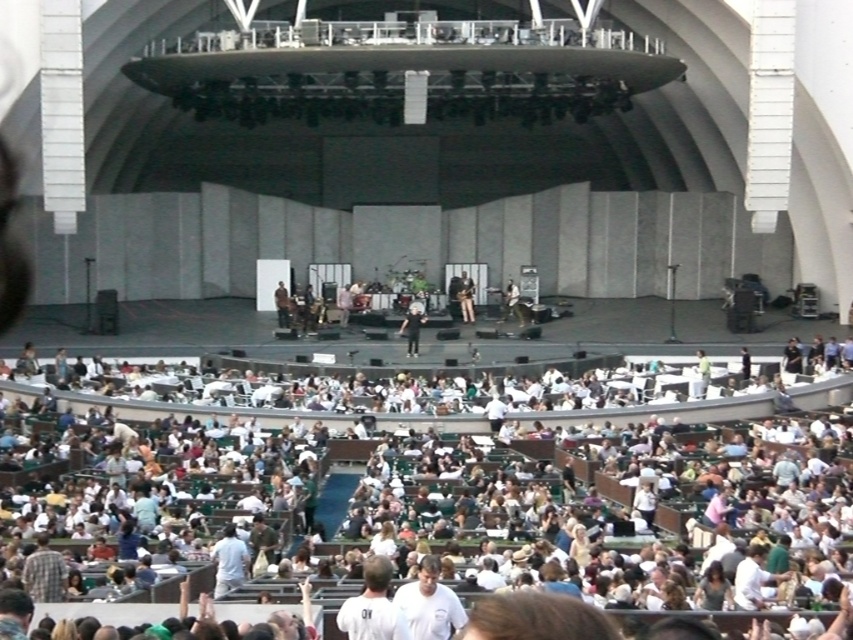
You are a photographer positioned at the front of the amphitheater and want to capture both the white fabric seats at lower center and the shiny black guitar at center in your shot. Which object should you focus on first to ensure both are in frame?

The white fabric seats at lower center are below the shiny black guitar at center, so you should focus on the shiny black guitar at center first to ensure both are in frame.

You are a photographer standing at the back of the amphitheater and want to take a photo of the black fabric shirt at center and the shiny black guitar at center. If your camera can focus on objects within a 5 meter range, will both subjects be in focus?

The black fabric shirt at center and the shiny black guitar at center are 4.81 meters apart from each other. Since the distance between them is within the 5 meter range of the camera, both subjects will be in focus.